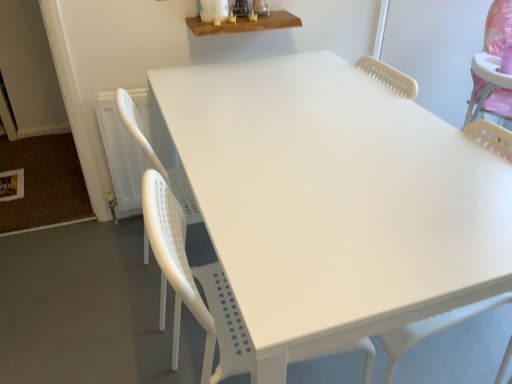
What do you see at coordinates (193, 285) in the screenshot?
I see `white plastic chair at center` at bounding box center [193, 285].

What are the coordinates of `white plastic swivel chair at center` in the screenshot? It's located at (432, 328).

Is white plastic chair at center facing towards wooden shelf at upper center, arranged as the 2th table when ordered from the bottom?

No, white plastic chair at center is not oriented towards wooden shelf at upper center, arranged as the 2th table when ordered from the bottom.

From the image's perspective, which is above, white plastic chair at center or wooden shelf at upper center, positioned as the first table in top-to-bottom order?

wooden shelf at upper center, positioned as the first table in top-to-bottom order, is shown above in the image.

Is white plastic chair at center taller or shorter than wooden shelf at upper center, arranged as the 2th table when ordered from the bottom?

Considering their sizes, white plastic chair at center has more height than wooden shelf at upper center, arranged as the 2th table when ordered from the bottom.

Is white plastic swivel chair at center outside of white plastic chair at center?

white plastic swivel chair at center lies outside white plastic chair at center's area.

You are a GUI agent. You are given a task and a screenshot of the screen. Output one action in this format:
    pyautogui.click(x=<x>, y=<y>)
    Task: Click on the swivel chair positioned vertically above the white plastic chair at center (from a real-world perspective)
    
    Given the screenshot: What is the action you would take?
    pyautogui.click(x=432, y=328)

From a real-world perspective, does white plastic swivel chair at center stand above white plastic chair at center?

Yes.

Considering the relative sizes of white plastic swivel chair at center and wooden shelf at upper center, positioned as the first table in top-to-bottom order, in the image provided, is white plastic swivel chair at center bigger than wooden shelf at upper center, positioned as the first table in top-to-bottom order,?

Correct, white plastic swivel chair at center is larger in size than wooden shelf at upper center, positioned as the first table in top-to-bottom order.

In the scene shown: Is white plastic swivel chair at center facing towards wooden shelf at upper center, positioned as the first table in top-to-bottom order?

No.

From the image's perspective, who appears lower, white plastic swivel chair at center or wooden shelf at upper center, arranged as the 2th table when ordered from the bottom?

white plastic swivel chair at center.

This screenshot has width=512, height=384. What are the coordinates of `table that is above the white plastic swivel chair at center (from a real-world perspective)` in the screenshot? It's located at (245, 24).

Does white plastic table at center, the second table in the top-to-bottom sequence, appear on the left side of white plastic swivel chair at center?

Indeed, white plastic table at center, the second table in the top-to-bottom sequence, is positioned on the left side of white plastic swivel chair at center.

Is white plastic table at center, the second table in the top-to-bottom sequence, taller than white plastic swivel chair at center?

In fact, white plastic table at center, the second table in the top-to-bottom sequence, may be shorter than white plastic swivel chair at center.

Is white plastic table at center, the 1th table ordered from the bottom, wider than white plastic swivel chair at center?

Correct, the width of white plastic table at center, the 1th table ordered from the bottom, exceeds that of white plastic swivel chair at center.

From a real-world perspective, which object stands above the other?

white plastic swivel chair at center.

Is wooden shelf at upper center, arranged as the 2th table when ordered from the bottom, looking in the opposite direction of white plastic swivel chair at center?

No, wooden shelf at upper center, arranged as the 2th table when ordered from the bottom,'s orientation is not away from white plastic swivel chair at center.

Considering the points (262, 24) and (484, 127), which point is behind, point (262, 24) or point (484, 127)?

The point (262, 24) is more distant.

Considering the relative sizes of wooden shelf at upper center, arranged as the 2th table when ordered from the bottom, and white plastic swivel chair at center in the image provided, is wooden shelf at upper center, arranged as the 2th table when ordered from the bottom, thinner than white plastic swivel chair at center?

Yes, wooden shelf at upper center, arranged as the 2th table when ordered from the bottom, is thinner than white plastic swivel chair at center.

Considering the relative positions of wooden shelf at upper center, arranged as the 2th table when ordered from the bottom, and white plastic swivel chair at center in the image provided, is wooden shelf at upper center, arranged as the 2th table when ordered from the bottom, to the right of white plastic swivel chair at center from the viewer's perspective?

Incorrect, wooden shelf at upper center, arranged as the 2th table when ordered from the bottom, is not on the right side of white plastic swivel chair at center.

From the image's perspective, which one is positioned lower, white plastic table at center, the second table in the top-to-bottom sequence, or wooden shelf at upper center, positioned as the first table in top-to-bottom order?

white plastic table at center, the second table in the top-to-bottom sequence, is shown below in the image.

Between white plastic table at center, the second table in the top-to-bottom sequence, and wooden shelf at upper center, positioned as the first table in top-to-bottom order, which one has more height?

Standing taller between the two is white plastic table at center, the second table in the top-to-bottom sequence.

Considering the sizes of objects white plastic table at center, the 1th table ordered from the bottom, and wooden shelf at upper center, positioned as the first table in top-to-bottom order, in the image provided, who is bigger, white plastic table at center, the 1th table ordered from the bottom, or wooden shelf at upper center, positioned as the first table in top-to-bottom order,?

white plastic table at center, the 1th table ordered from the bottom.

Are white plastic table at center, the second table in the top-to-bottom sequence, and wooden shelf at upper center, positioned as the first table in top-to-bottom order, far apart?

That's not correct — white plastic table at center, the second table in the top-to-bottom sequence, is a little close to wooden shelf at upper center, positioned as the first table in top-to-bottom order.

From the image's perspective, between white plastic chair at center and white plastic swivel chair at center, which one is located above?

white plastic swivel chair at center, from the image's perspective.

Can you confirm if white plastic chair at center is thinner than white plastic swivel chair at center?

In fact, white plastic chair at center might be wider than white plastic swivel chair at center.

Is point (155, 173) farther from viewer compared to point (420, 320)?

Yes.

Does white plastic chair at center appear on the right side of white plastic swivel chair at center?

No, white plastic chair at center is not to the right of white plastic swivel chair at center.

Locate an element on the screen. chair that is in front of the wooden shelf at upper center, positioned as the first table in top-to-bottom order is located at coordinates (193, 285).

In order to click on chair lying on the left of white plastic swivel chair at center in this screenshot , I will do `click(193, 285)`.

Considering their positions, is white plastic table at center, the second table in the top-to-bottom sequence, positioned closer to white plastic chair at center than wooden shelf at upper center, positioned as the first table in top-to-bottom order?

The object closer to white plastic chair at center is white plastic table at center, the second table in the top-to-bottom sequence.

Considering their positions, is white plastic chair at center positioned closer to wooden shelf at upper center, arranged as the 2th table when ordered from the bottom, than white plastic table at center, the 1th table ordered from the bottom?

Based on the image, white plastic table at center, the 1th table ordered from the bottom, appears to be nearer to wooden shelf at upper center, arranged as the 2th table when ordered from the bottom.

Estimate the real-world distances between objects in this image. Which object is closer to wooden shelf at upper center, arranged as the 2th table when ordered from the bottom, white plastic table at center, the 1th table ordered from the bottom, or white plastic chair at center?

Among the two, white plastic table at center, the 1th table ordered from the bottom, is located nearer to wooden shelf at upper center, arranged as the 2th table when ordered from the bottom.

Estimate the real-world distances between objects in this image. Which object is further from white plastic chair at center, wooden shelf at upper center, positioned as the first table in top-to-bottom order, or white plastic swivel chair at center?

wooden shelf at upper center, positioned as the first table in top-to-bottom order, is further to white plastic chair at center.

Estimate the real-world distances between objects in this image. Which object is closer to wooden shelf at upper center, positioned as the first table in top-to-bottom order, white plastic chair at center or white plastic swivel chair at center?

Among the two, white plastic chair at center is located nearer to wooden shelf at upper center, positioned as the first table in top-to-bottom order.

Which object lies nearer to the anchor point white plastic chair at center, wooden shelf at upper center, arranged as the 2th table when ordered from the bottom, or white plastic table at center, the second table in the top-to-bottom sequence?

Based on the image, white plastic table at center, the second table in the top-to-bottom sequence, appears to be nearer to white plastic chair at center.

In the scene shown: Which object lies nearer to the anchor point wooden shelf at upper center, positioned as the first table in top-to-bottom order, white plastic swivel chair at center or white plastic table at center, the second table in the top-to-bottom sequence?

The object closer to wooden shelf at upper center, positioned as the first table in top-to-bottom order, is white plastic table at center, the second table in the top-to-bottom sequence.

Considering their positions, is wooden shelf at upper center, arranged as the 2th table when ordered from the bottom, positioned closer to white plastic table at center, the 1th table ordered from the bottom, than white plastic chair at center?

The object closer to white plastic table at center, the 1th table ordered from the bottom, is white plastic chair at center.

Where is `swivel chair between wooden shelf at upper center, arranged as the 2th table when ordered from the bottom, and white plastic table at center, the second table in the top-to-bottom sequence, from top to bottom`? This screenshot has height=384, width=512. swivel chair between wooden shelf at upper center, arranged as the 2th table when ordered from the bottom, and white plastic table at center, the second table in the top-to-bottom sequence, from top to bottom is located at coordinates (432, 328).

The image size is (512, 384). In order to click on chair between white plastic table at center, the 1th table ordered from the bottom, and white plastic swivel chair at center in this screenshot , I will do `click(193, 285)`.

I want to click on chair between wooden shelf at upper center, arranged as the 2th table when ordered from the bottom, and white plastic table at center, the 1th table ordered from the bottom, in the vertical direction, so point(193,285).

The image size is (512, 384). Find the location of `swivel chair between wooden shelf at upper center, arranged as the 2th table when ordered from the bottom, and white plastic chair at center, in the vertical direction`. swivel chair between wooden shelf at upper center, arranged as the 2th table when ordered from the bottom, and white plastic chair at center, in the vertical direction is located at coordinates (432, 328).